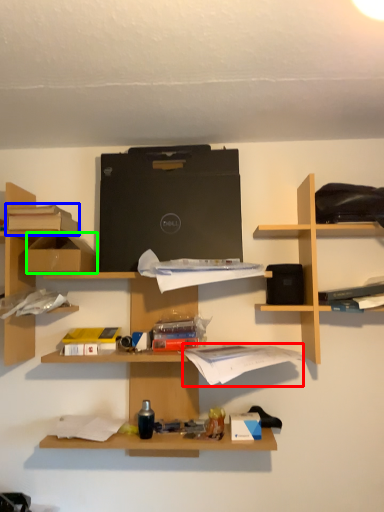
Question: Which object is the farthest from book (highlighted by a red box)? Choose among these: book (highlighted by a blue box) or cardboard box (highlighted by a green box).

Choices:
 (A) book
 (B) cardboard box

Answer: (A)